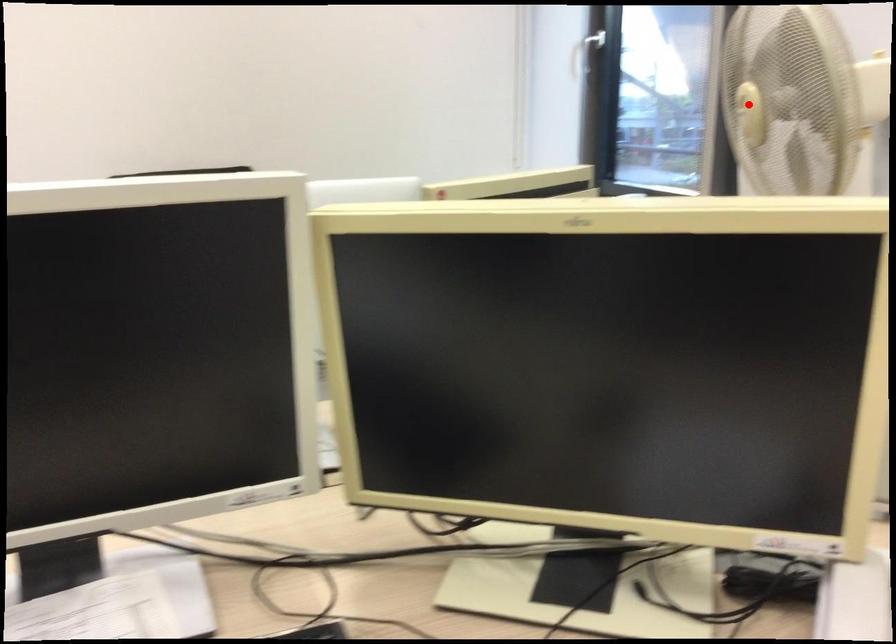
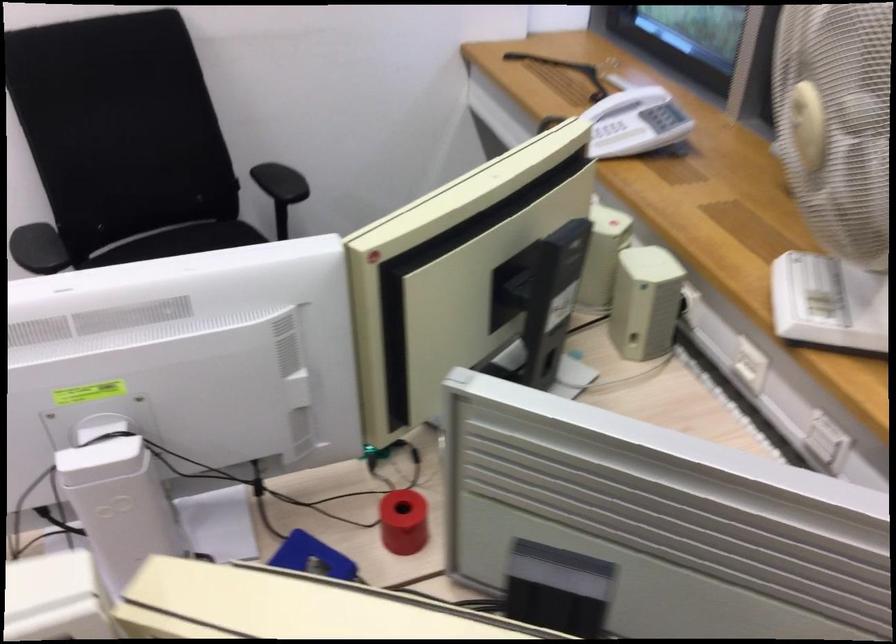
Locate, in the second image, the point that corresponds to the highlighted location in the first image.

(807, 125)